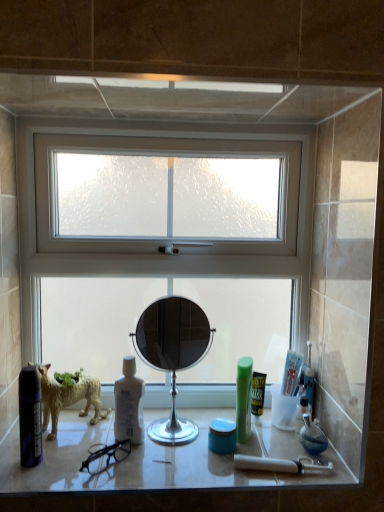
Locate an element on the screen. The image size is (384, 512). vacant area that lies between silver/metallic mirror at center and matte black can at left is located at coordinates (105, 453).